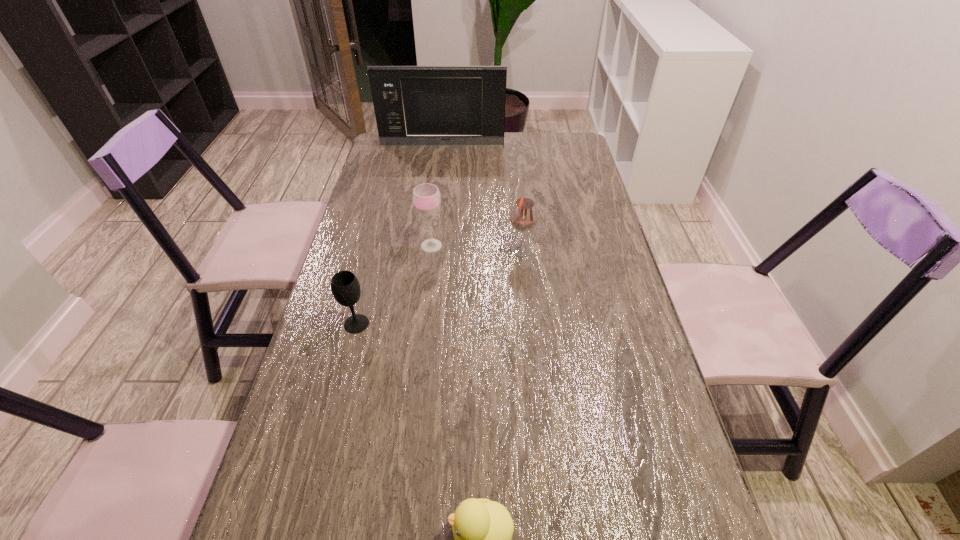
In order to click on object that is at the far edge in this screenshot , I will do `click(414, 105)`.

You are a GUI agent. You are given a task and a screenshot of the screen. Output one action in this format:
    pyautogui.click(x=<x>, y=<y>)
    Task: Click on the microwave oven that is positioned at the left edge
    The width and height of the screenshot is (960, 540).
    Given the screenshot: What is the action you would take?
    pyautogui.click(x=414, y=105)

The image size is (960, 540). What are the coordinates of `wineglass at the left edge` in the screenshot? It's located at (345, 286).

The height and width of the screenshot is (540, 960). Find the location of `object at the far left corner`. object at the far left corner is located at coordinates (414, 105).

Image resolution: width=960 pixels, height=540 pixels. I want to click on blank space at the far edge, so click(x=462, y=149).

Find the location of a particular element. free space at the left edge of the desktop is located at coordinates (302, 402).

Locate an element on the screen. The width and height of the screenshot is (960, 540). free space at the right edge of the desktop is located at coordinates (595, 273).

Image resolution: width=960 pixels, height=540 pixels. Identify the location of blank space at the far left corner of the desktop. (402, 154).

Identify the location of blank space at the far right corner. The image size is (960, 540). (542, 146).

You are a GUI agent. You are given a task and a screenshot of the screen. Output one action in this format:
    pyautogui.click(x=<x>, y=<y>)
    Task: Click on the vacant area between the rightmost wineglass and the fourth farthest object
    The height and width of the screenshot is (540, 960).
    Given the screenshot: What is the action you would take?
    pyautogui.click(x=439, y=287)